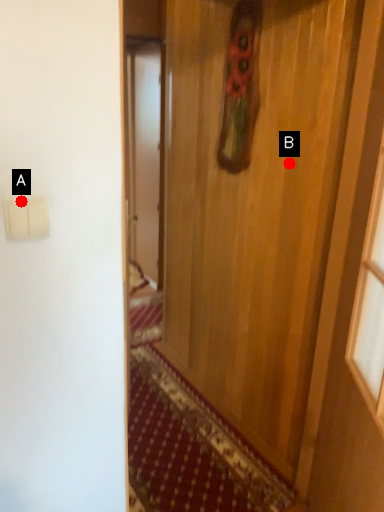
Question: Two points are circled on the image, labeled by A and B beside each circle. Which of the following is the closest to the observer?

Choices:
 (A) A is closer
 (B) B is closer

Answer: (A)